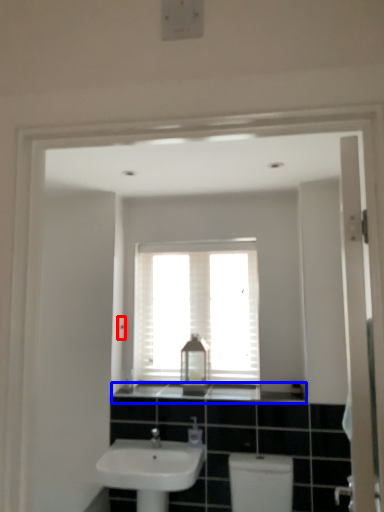
Question: Among these objects, which one is farthest to the camera, light switch (highlighted by a red box) or counter top (highlighted by a blue box)?

Choices:
 (A) light switch
 (B) counter top

Answer: (A)